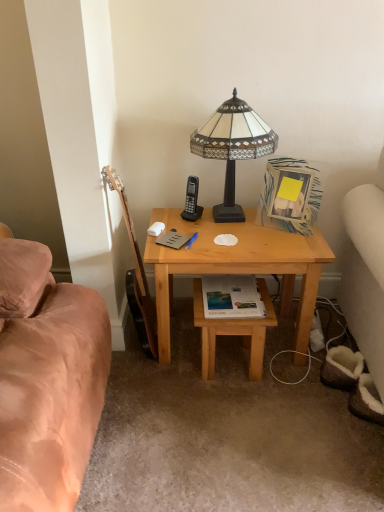
Question: Would you say light brown wooden stool at lower center is part of brown wood guitar at left's contents?

Choices:
 (A) yes
 (B) no

Answer: (B)

Question: Considering the relative sizes of brown wood guitar at left and light brown wooden stool at lower center in the image provided, is brown wood guitar at left bigger than light brown wooden stool at lower center?

Choices:
 (A) yes
 (B) no

Answer: (B)

Question: From the image's perspective, is brown wood guitar at left over light brown wooden stool at lower center?

Choices:
 (A) yes
 (B) no

Answer: (A)

Question: Considering the relative positions of brown wood guitar at left and light brown wooden stool at lower center in the image provided, is brown wood guitar at left to the right of light brown wooden stool at lower center from the viewer's perspective?

Choices:
 (A) yes
 (B) no

Answer: (B)

Question: Is brown wood guitar at left shorter than light brown wooden stool at lower center?

Choices:
 (A) no
 (B) yes

Answer: (A)

Question: Choose the correct answer: Is light wood desk at center inside brown wood guitar at left or outside it?

Choices:
 (A) inside
 (B) outside

Answer: (B)

Question: In the image, is light wood desk at center positioned in front of or behind brown wood guitar at left?

Choices:
 (A) behind
 (B) front

Answer: (A)

Question: Is point (152, 261) positioned closer to the camera than point (132, 314)?

Choices:
 (A) closer
 (B) farther

Answer: (A)

Question: Based on their positions, is light wood desk at center located to the left or right of brown wood guitar at left?

Choices:
 (A) right
 (B) left

Answer: (A)

Question: In terms of size, does matte paper book at center, positioned as the second book in left-to-right order, appear bigger or smaller than light brown wooden stool at lower center?

Choices:
 (A) big
 (B) small

Answer: (B)

Question: Which is correct: matte paper book at center, which is counted as the first book, starting from the right, is inside light brown wooden stool at lower center, or outside of it?

Choices:
 (A) inside
 (B) outside

Answer: (B)

Question: In terms of width, does matte paper book at center, positioned as the 1th book in bottom-to-top order, look wider or thinner when compared to light brown wooden stool at lower center?

Choices:
 (A) wide
 (B) thin

Answer: (B)

Question: Relative to light brown wooden stool at lower center, is matte paper book at center, which is counted as the first book, starting from the right, in front or behind?

Choices:
 (A) behind
 (B) front

Answer: (A)

Question: From a real-world perspective, is black plastic phone at center above or below matte paper book at center, positioned as the second book in left-to-right order?

Choices:
 (A) below
 (B) above

Answer: (B)

Question: Based on their sizes in the image, would you say black plastic phone at center is bigger or smaller than matte paper book at center, which is counted as the first book, starting from the right?

Choices:
 (A) big
 (B) small

Answer: (A)